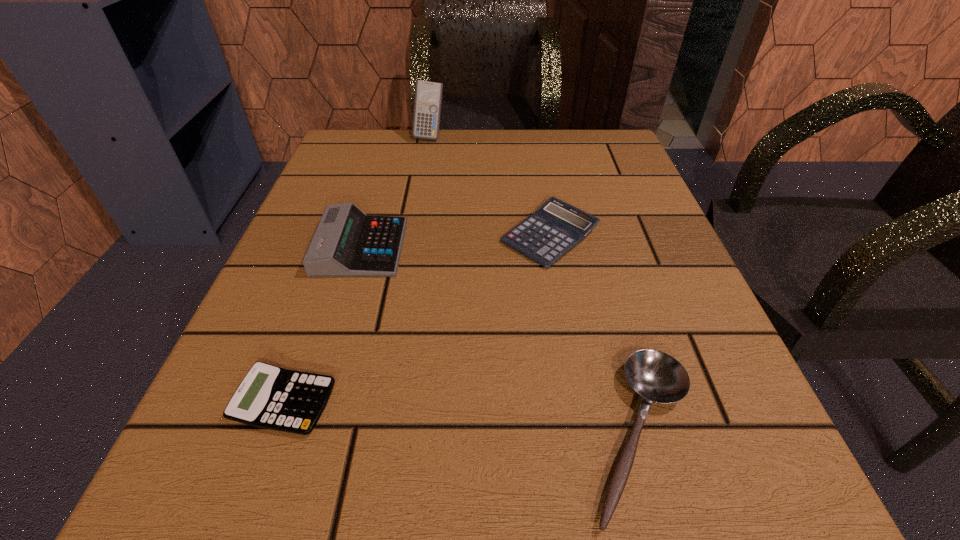
Identify the location of unoccupied area between the second tallest calculator and the nearest calculator. The height and width of the screenshot is (540, 960). (323, 325).

Identify the location of vacant space that is in between the farthest object and the rightmost calculator. (490, 186).

Find the location of a particular element. This screenshot has height=540, width=960. vacant area that lies between the farthest object and the rightmost calculator is located at coordinates (490, 186).

Point out which object is positioned as the second nearest to the tallest calculator. Please provide its 2D coordinates. Your answer should be formatted as a tuple, i.e. [(x, y)], where the tuple contains the x and y coordinates of a point satisfying the conditions above.

[(347, 243)]

The width and height of the screenshot is (960, 540). I want to click on object that is the third closest to the second tallest calculator, so click(x=657, y=377).

Locate an element on the screen. The width and height of the screenshot is (960, 540). the closest calculator to the rightmost calculator is located at coordinates (347, 243).

Identify which calculator is the third closest to the nearest calculator. Please provide its 2D coordinates. Your answer should be formatted as a tuple, i.e. [(x, y)], where the tuple contains the x and y coordinates of a point satisfying the conditions above.

[(428, 96)]

At what (x,y) coordinates should I click in order to perform the action: click on vacant point that satisfies the following two spatial constraints: 1. on the front-facing side of the farthest object; 2. on the left side of the rightmost calculator. Please return your answer as a coordinate pair (x, y). The image size is (960, 540). Looking at the image, I should click on (412, 236).

Locate an element on the screen. Image resolution: width=960 pixels, height=540 pixels. free space that satisfies the following two spatial constraints: 1. on the front-facing side of the farthest calculator; 2. on the left side of the rightmost calculator is located at coordinates (412, 236).

The image size is (960, 540). I want to click on free space in the image that satisfies the following two spatial constraints: 1. on the front-facing side of the rightmost calculator; 2. on the right side of the tallest object, so click(412, 236).